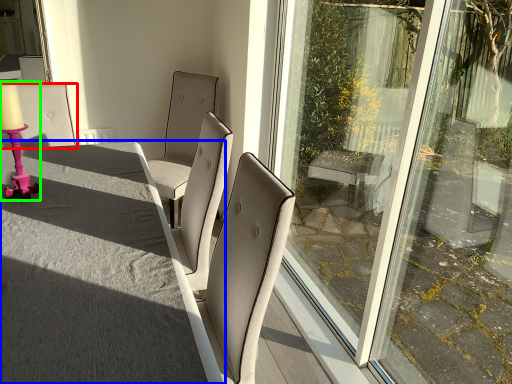
Question: Which is nearer to the chair (highlighted by a red box)? table (highlighted by a blue box) or candle holder (highlighted by a green box).

Choices:
 (A) table
 (B) candle holder

Answer: (B)